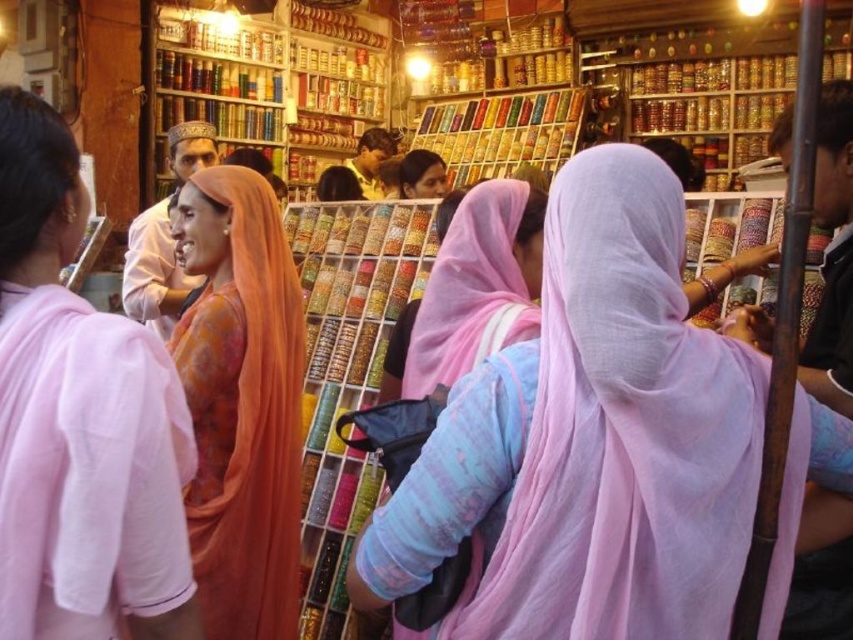
How far apart are light blue fabric at center and matte pink scarf at center?

They are 5.14 meters apart.

Between light blue fabric at center and matte pink scarf at center, which one has less height?

With less height is matte pink scarf at center.

Locate an element on the screen. The image size is (853, 640). light blue fabric at center is located at coordinates (473, 288).

Can you confirm if orange silk saree at left is shorter than orange silk robe at center?

No.

Who is positioned more to the right, orange silk saree at left or orange silk robe at center?

orange silk robe at center is more to the right.

Which is behind, point (45, 264) or point (357, 164)?

The point (357, 164) is behind.

The image size is (853, 640). Identify the location of orange silk saree at left. (79, 420).

Who is positioned more to the right, matte pink scarf at center or orange silk robe at center?

matte pink scarf at center

Locate an element on the screen. The width and height of the screenshot is (853, 640). matte pink scarf at center is located at coordinates (421, 173).

In the scene shown: Who is more distant from viewer, (x=445, y=186) or (x=368, y=198)?

Point (x=368, y=198)

You are a GUI agent. You are given a task and a screenshot of the screen. Output one action in this format:
    pyautogui.click(x=<x>, y=<y>)
    Task: Click on the matte pink scarf at center
    The width and height of the screenshot is (853, 640).
    Given the screenshot: What is the action you would take?
    pyautogui.click(x=421, y=173)